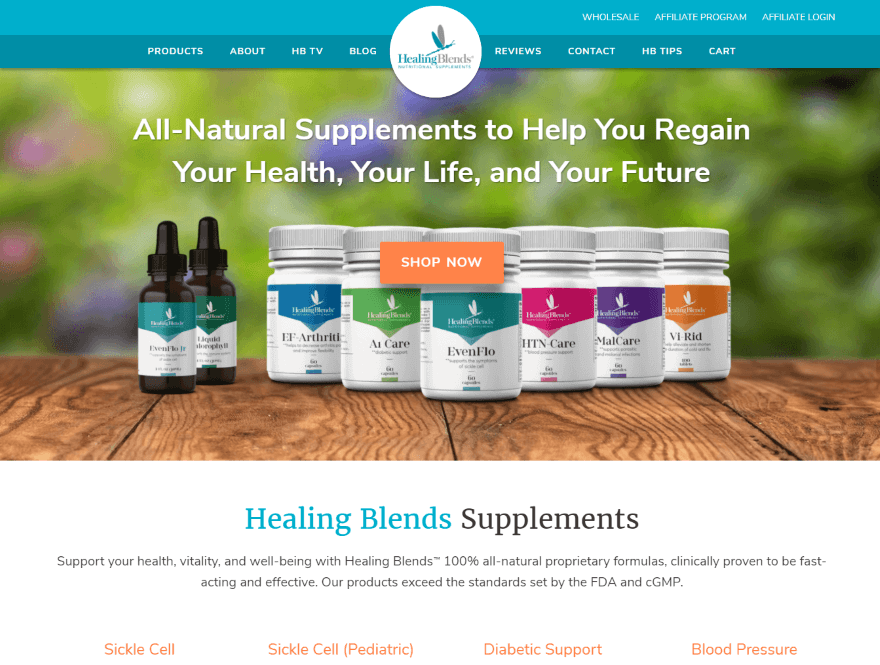
You are a GUI agent. You are given a task and a screenshot of the screen. Output one action in this format:
    pyautogui.click(x=<x>, y=<y>)
    Task: Click on the wood table
    The image size is (880, 665).
    Given the screenshot: What is the action you would take?
    pyautogui.click(x=349, y=436), pyautogui.click(x=596, y=402), pyautogui.click(x=812, y=392), pyautogui.click(x=72, y=411)